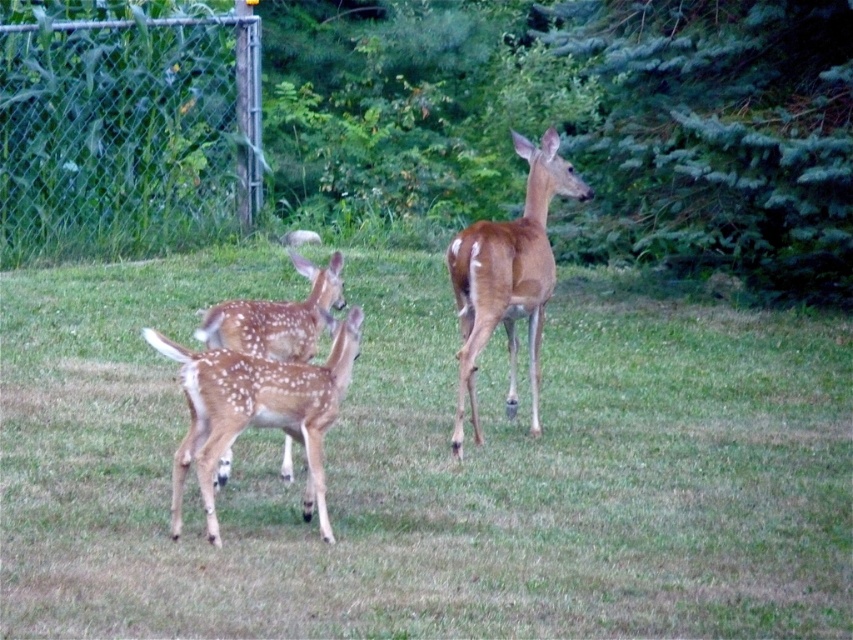
You are a photographer trying to capture a closeup of the spotted fur deer at center while standing on the green grass at center. Can you reach the deer without moving from your current position?

The green grass at center and spotted fur deer at center are 38.11 inches apart from each other, so yes, you can reach the spotted fur deer at center from the green grass at center without moving since the distance is manageable for a photographer to capture a closeup.

You are standing at the origin point of the coordinate system in the image. You see a point labeled at coordinate point (257, 412). What object is located at that point?

The point at coordinate point (257, 412) corresponds to the spotted fur deer at center.